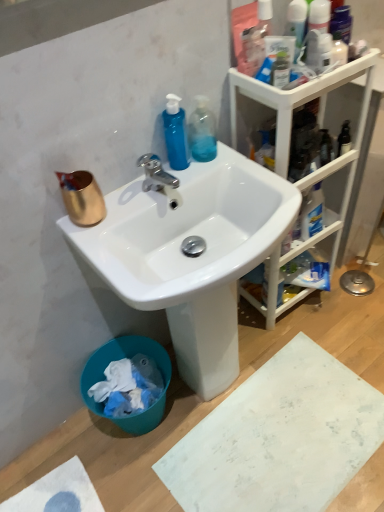
Find the location of a particular element. This screenshot has height=512, width=384. vacant space in front of teal plastic trash bin at lower left is located at coordinates (122, 477).